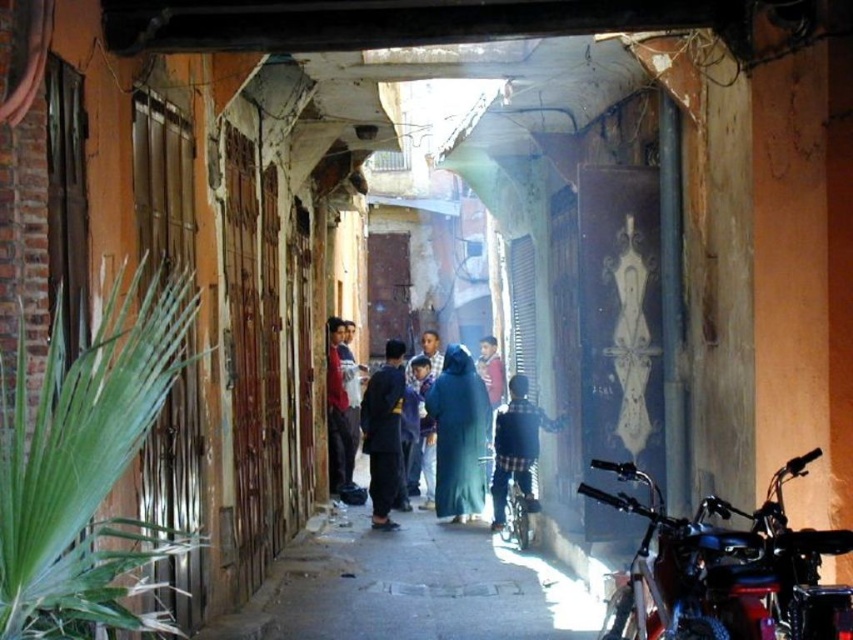
Between blue fabric dress at center and dark brown fabric jacket at center, which one is positioned higher?

Positioned higher is dark brown fabric jacket at center.

Can you confirm if blue fabric dress at center is positioned below dark brown fabric jacket at center?

Yes, blue fabric dress at center is below dark brown fabric jacket at center.

Which is in front, point (483, 392) or point (389, 504)?

Positioned in front is point (389, 504).

Find the location of a particular element. blue fabric dress at center is located at coordinates (459, 435).

Between shiny black motorcycle at lower right and blue fabric dress at center, which one has more height?

With more height is blue fabric dress at center.

Which is above, shiny black motorcycle at lower right or blue fabric dress at center?

shiny black motorcycle at lower right

Is point (654, 612) behind point (462, 467)?

No.

At what (x,y) coordinates should I click in order to perform the action: click on shiny black motorcycle at lower right. Please return your answer as a coordinate pair (x, y). Looking at the image, I should click on (727, 570).

Who is lower down, shiny black motorcycle at lower right or dark blue fabric at center?

dark blue fabric at center is below.

Consider the image. Does shiny black motorcycle at lower right come behind dark blue fabric at center?

No, it is not.

Is point (643, 548) positioned behind point (328, 480)?

No, it is not.

In order to click on shiny black motorcycle at lower right in this screenshot , I will do `click(727, 570)`.